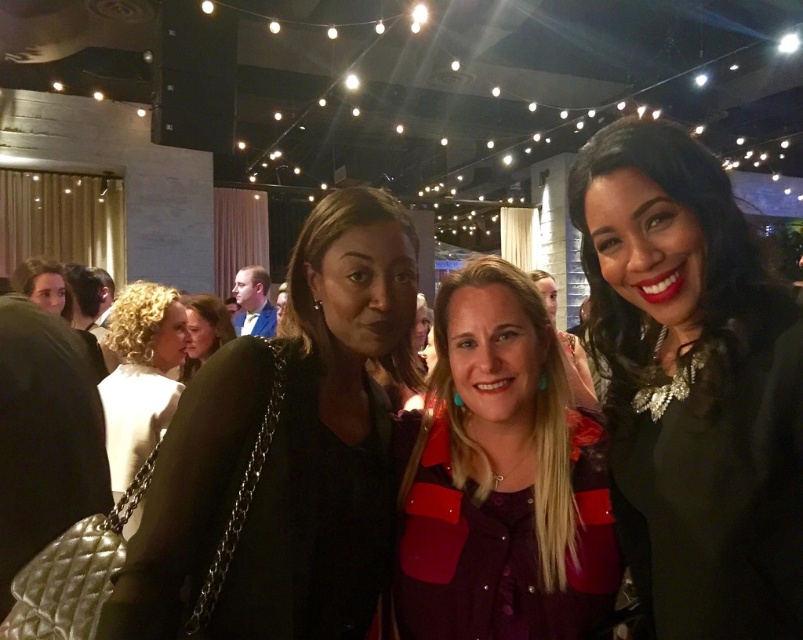
Question: Which object is the farthest from the matte black jacket at center?

Choices:
 (A) white satin dress at left
 (B) matte burgundy blouse at center

Answer: (B)

Question: Which of the following is the closest to the observer?

Choices:
 (A) matte black jacket at center
 (B) shiny black dress at center
 (C) matte burgundy blouse at center
 (D) white satin dress at left

Answer: (B)

Question: Where is black quilted purse at left located in relation to matte burgundy blouse at center in the image?

Choices:
 (A) below
 (B) above

Answer: (B)

Question: Can you confirm if white satin dress at left is positioned below matte black jacket at center?

Choices:
 (A) no
 (B) yes

Answer: (B)

Question: Which of these objects is positioned closest to the matte black jacket at center?

Choices:
 (A) white satin dress at left
 (B) black quilted purse at left
 (C) shiny black dress at center
 (D) matte burgundy blouse at center

Answer: (A)

Question: Can you confirm if matte burgundy blouse at center is wider than white satin dress at left?

Choices:
 (A) no
 (B) yes

Answer: (A)